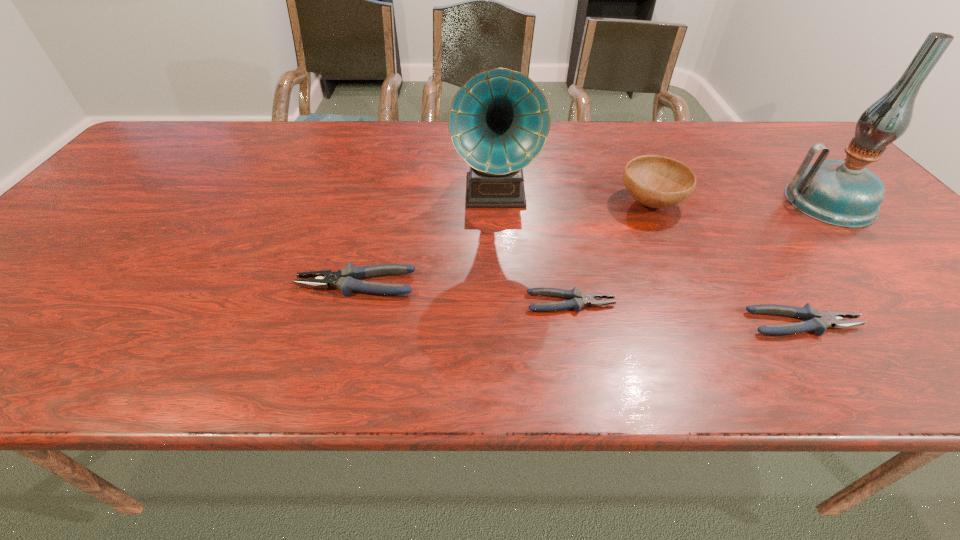
At what (x,y) coordinates should I click in order to perform the action: click on free spot between the oil lamp and the second pliers from right to left. Please return your answer as a coordinate pair (x, y). The image size is (960, 540). Looking at the image, I should click on (699, 252).

Identify the location of empty space between the second tallest object and the shortest pliers. (533, 248).

Identify the location of object that stands as the closest to the rightmost object. The image size is (960, 540). (655, 181).

Identify which object is the fifth closest to the shortest pliers. Please provide its 2D coordinates. Your answer should be formatted as a tuple, i.e. [(x, y)], where the tuple contains the x and y coordinates of a point satisfying the conditions above.

[(842, 193)]

Locate which pliers ranks in proximity to the leftmost pliers. Please provide its 2D coordinates. Your answer should be formatted as a tuple, i.e. [(x, y)], where the tuple contains the x and y coordinates of a point satisfying the conditions above.

[(578, 299)]

Identify which pliers is the second closest to the rightmost pliers. Please provide its 2D coordinates. Your answer should be formatted as a tuple, i.e. [(x, y)], where the tuple contains the x and y coordinates of a point satisfying the conditions above.

[(345, 279)]

Find the location of a particular element. blank space that satisfies the following two spatial constraints: 1. from the horn of the phonograph_record; 2. on the right side of the fourth object from left to right is located at coordinates (496, 204).

Where is `free region that satisfies the following two spatial constraints: 1. on the front side of the bowl; 2. at the gripping part of the leftmost pliers`? This screenshot has height=540, width=960. free region that satisfies the following two spatial constraints: 1. on the front side of the bowl; 2. at the gripping part of the leftmost pliers is located at coordinates (686, 284).